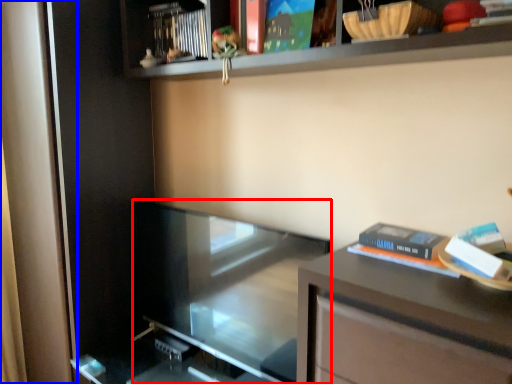
Question: Among these objects, which one is nearest to the camera, glass door (highlighted by a red box) or screen door (highlighted by a blue box)?

Choices:
 (A) glass door
 (B) screen door

Answer: (A)